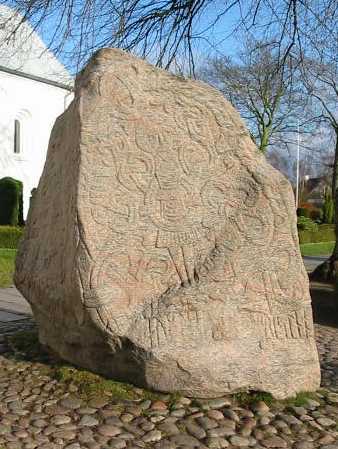
The width and height of the screenshot is (338, 449). Identify the location of door. (8, 198).